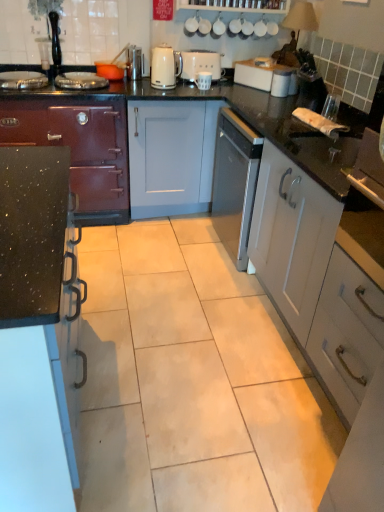
Where is `free location above black speckled countertop at left, positioned as the second cabinetry in right-to-left order (from a real-world perspective)`? The height and width of the screenshot is (512, 384). free location above black speckled countertop at left, positioned as the second cabinetry in right-to-left order (from a real-world perspective) is located at coordinates (31, 209).